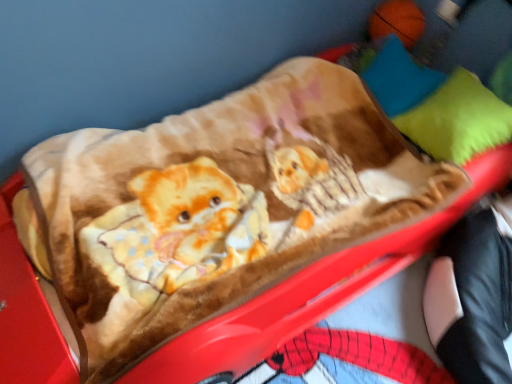
The height and width of the screenshot is (384, 512). What do you see at coordinates (398, 78) in the screenshot?
I see `blue soft pillow at upper right, the 2th pillow ordered from the bottom` at bounding box center [398, 78].

How much space does green soft pillow at upper right, the 1th pillow in the bottom-to-top sequence, occupy vertically?

It is 10.73 inches.

Identify the location of blue soft pillow at upper right, the 1th pillow when ordered from top to bottom. The height and width of the screenshot is (384, 512). (398, 78).

Between point (408, 104) and point (475, 85), which one is positioned in front?

The point (475, 85) is closer.

Can green soft pillow at upper right, arranged as the second pillow when viewed from the top, be found inside blue soft pillow at upper right, the 1th pillow when ordered from top to bottom?

That's incorrect, green soft pillow at upper right, arranged as the second pillow when viewed from the top, is not inside blue soft pillow at upper right, the 1th pillow when ordered from top to bottom.

Is blue soft pillow at upper right, the 1th pillow when ordered from top to bottom, placed right next to green soft pillow at upper right, the 1th pillow in the bottom-to-top sequence?

No, blue soft pillow at upper right, the 1th pillow when ordered from top to bottom, is not touching green soft pillow at upper right, the 1th pillow in the bottom-to-top sequence.

Is blue soft pillow at upper right, the 1th pillow when ordered from top to bottom, bigger or smaller than green soft pillow at upper right, the 1th pillow in the bottom-to-top sequence?

Clearly, blue soft pillow at upper right, the 1th pillow when ordered from top to bottom, is smaller in size than green soft pillow at upper right, the 1th pillow in the bottom-to-top sequence.

Is black leather pants at lower right positioned far away from green soft pillow at upper right, arranged as the second pillow when viewed from the top?

No.

From a real-world perspective, is black leather pants at lower right physically located above or below green soft pillow at upper right, the 1th pillow in the bottom-to-top sequence?

black leather pants at lower right is below green soft pillow at upper right, the 1th pillow in the bottom-to-top sequence.

From the image's perspective, which one is positioned higher, black leather pants at lower right or green soft pillow at upper right, arranged as the second pillow when viewed from the top?

green soft pillow at upper right, arranged as the second pillow when viewed from the top, is shown above in the image.

Considering the points (478, 257) and (502, 120), which point is in front, point (478, 257) or point (502, 120)?

The point (478, 257) is closer to the camera.

Can you tell me how much green soft pillow at upper right, the 1th pillow in the bottom-to-top sequence, and blue soft pillow at upper right, the 1th pillow when ordered from top to bottom, differ in facing direction?

The angle between the facing direction of green soft pillow at upper right, the 1th pillow in the bottom-to-top sequence, and the facing direction of blue soft pillow at upper right, the 1th pillow when ordered from top to bottom, is 3.76 degrees.

Is green soft pillow at upper right, arranged as the second pillow when viewed from the top, facing away from blue soft pillow at upper right, the 2th pillow ordered from the bottom?

No.

Is point (510, 110) closer or farther from the camera than point (413, 91)?

Point (510, 110) is positioned closer to the camera compared to point (413, 91).

Identify the location of pillow directly beneath the green soft pillow at upper right, arranged as the second pillow when viewed from the top (from a real-world perspective). This screenshot has height=384, width=512. (398, 78).

Is green soft pillow at upper right, arranged as the second pillow when viewed from the top, facing towards black leather pants at lower right?

No, green soft pillow at upper right, arranged as the second pillow when viewed from the top, is not oriented towards black leather pants at lower right.

Is green soft pillow at upper right, the 1th pillow in the bottom-to-top sequence, located outside black leather pants at lower right?

Indeed, green soft pillow at upper right, the 1th pillow in the bottom-to-top sequence, is completely outside black leather pants at lower right.

Considering the relative sizes of green soft pillow at upper right, arranged as the second pillow when viewed from the top, and black leather pants at lower right in the image provided, is green soft pillow at upper right, arranged as the second pillow when viewed from the top, bigger than black leather pants at lower right?

Actually, green soft pillow at upper right, arranged as the second pillow when viewed from the top, might be smaller than black leather pants at lower right.

Is point (450, 84) closer to viewer compared to point (434, 322)?

That is False.

From the image's perspective, is blue soft pillow at upper right, the 2th pillow ordered from the bottom, on top of black leather pants at lower right?

Correct, blue soft pillow at upper right, the 2th pillow ordered from the bottom, appears higher than black leather pants at lower right in the image.

From a real-world perspective, between blue soft pillow at upper right, the 2th pillow ordered from the bottom, and black leather pants at lower right, who is vertically higher?

blue soft pillow at upper right, the 2th pillow ordered from the bottom, is physically above.

Can you confirm if blue soft pillow at upper right, the 1th pillow when ordered from top to bottom, is thinner than black leather pants at lower right?

Correct, the width of blue soft pillow at upper right, the 1th pillow when ordered from top to bottom, is less than that of black leather pants at lower right.

How different are the orientations of black leather pants at lower right and blue soft pillow at upper right, the 1th pillow when ordered from top to bottom, in degrees?

The facing directions of black leather pants at lower right and blue soft pillow at upper right, the 1th pillow when ordered from top to bottom, are 4.42 degrees apart.

Between black leather pants at lower right and blue soft pillow at upper right, the 1th pillow when ordered from top to bottom, which one has less height?

With less height is blue soft pillow at upper right, the 1th pillow when ordered from top to bottom.

Is black leather pants at lower right positioned with its back to blue soft pillow at upper right, the 1th pillow when ordered from top to bottom?

No, blue soft pillow at upper right, the 1th pillow when ordered from top to bottom, is not at the back of black leather pants at lower right.

At what (x,y) coordinates should I click in order to perform the action: click on the 2nd pillow behind the black leather pants at lower right. Please return your answer as a coordinate pair (x, y). Looking at the image, I should click on (398, 78).

The height and width of the screenshot is (384, 512). I want to click on pillow above the blue soft pillow at upper right, the 1th pillow when ordered from top to bottom (from a real-world perspective), so click(x=457, y=119).

From the black leather pants at lower right, count 1st pillows backward and point to it. Please provide its 2D coordinates.

[(457, 119)]

Considering their positions, is green soft pillow at upper right, arranged as the second pillow when viewed from the top, positioned closer to blue soft pillow at upper right, the 1th pillow when ordered from top to bottom, than black leather pants at lower right?

green soft pillow at upper right, arranged as the second pillow when viewed from the top, lies closer to blue soft pillow at upper right, the 1th pillow when ordered from top to bottom, than the other object.

Looking at the image, which one is located closer to black leather pants at lower right, green soft pillow at upper right, arranged as the second pillow when viewed from the top, or blue soft pillow at upper right, the 1th pillow when ordered from top to bottom?

green soft pillow at upper right, arranged as the second pillow when viewed from the top, lies closer to black leather pants at lower right than the other object.

Looking at the image, which one is located further to blue soft pillow at upper right, the 2th pillow ordered from the bottom, black leather pants at lower right or green soft pillow at upper right, the 1th pillow in the bottom-to-top sequence?

black leather pants at lower right.

Looking at the image, which one is located further to black leather pants at lower right, blue soft pillow at upper right, the 1th pillow when ordered from top to bottom, or green soft pillow at upper right, arranged as the second pillow when viewed from the top?

Based on the image, blue soft pillow at upper right, the 1th pillow when ordered from top to bottom, appears to be further to black leather pants at lower right.

Based on their spatial positions, is blue soft pillow at upper right, the 1th pillow when ordered from top to bottom, or black leather pants at lower right closer to green soft pillow at upper right, the 1th pillow in the bottom-to-top sequence?

Based on the image, blue soft pillow at upper right, the 1th pillow when ordered from top to bottom, appears to be nearer to green soft pillow at upper right, the 1th pillow in the bottom-to-top sequence.

Estimate the real-world distances between objects in this image. Which object is further from green soft pillow at upper right, arranged as the second pillow when viewed from the top, black leather pants at lower right or blue soft pillow at upper right, the 1th pillow when ordered from top to bottom?

black leather pants at lower right.

The height and width of the screenshot is (384, 512). I want to click on pillow between blue soft pillow at upper right, the 1th pillow when ordered from top to bottom, and black leather pants at lower right from top to bottom, so click(457, 119).